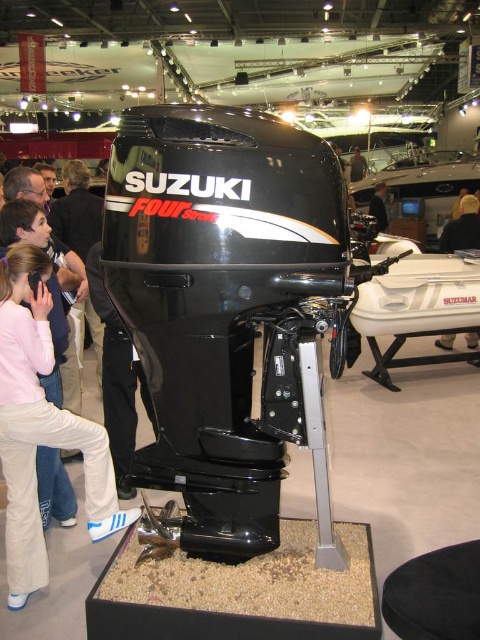
Question: Which object appears closest to the camera in this image?

Choices:
 (A) light brown leather jacket at center
 (B) black plastic outboard motor at center

Answer: (B)

Question: Is light brown leather jacket at center below black plastic person at center?

Choices:
 (A) no
 (B) yes

Answer: (B)

Question: Does black plastic person at center appear under black leather jacket at upper center?

Choices:
 (A) no
 (B) yes

Answer: (B)

Question: Can you confirm if black plastic outboard motor at center is positioned to the right of black leather jacket at upper center?

Choices:
 (A) yes
 (B) no

Answer: (B)

Question: Which object appears closest to the camera in this image?

Choices:
 (A) black leather jacket at upper center
 (B) light brown leather jacket at center
 (C) black plastic person at center

Answer: (B)

Question: Which object is closer to the camera taking this photo?

Choices:
 (A) black plastic outboard motor at center
 (B) light brown leather jacket at center

Answer: (A)